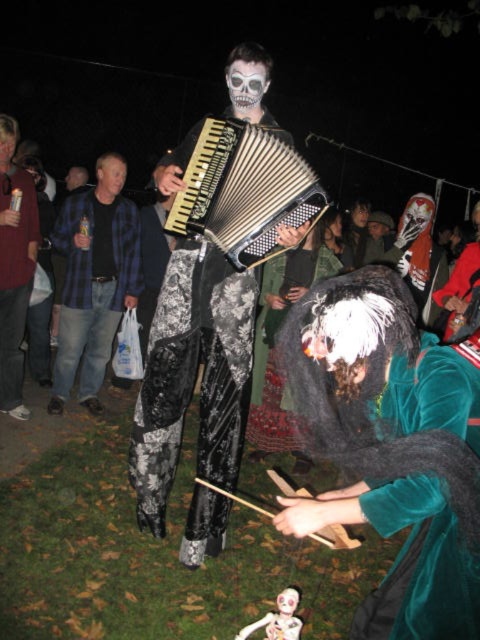
You are standing in the Halloween event area and want to take a photo of both the point at position (139, 413) and the point at position (261, 148). Which point will appear closer to the camera in the photo?

Point at position (139, 413) will appear closer to the camera in the photo because it is further to the viewer than point at position (261, 148).

You are a photographer trying to capture the Halloween performers. You notice two faces in your viewfinder. The smooth skin face at upper left and the smooth white mask at center. Which face appears narrower in your photo?

The smooth skin face at upper left is thinner than the smooth white mask at center, so the smooth skin face at upper left appears narrower in the photo.

You are a photographer trying to capture the white matte skull at center in the image. The camera is set to focus on the point at coordinates point (288, 602). Will this point be on the white matte skull at center?

Yes, the point (288, 602) corresponds to the white matte skull at center, so the focus will be on it.